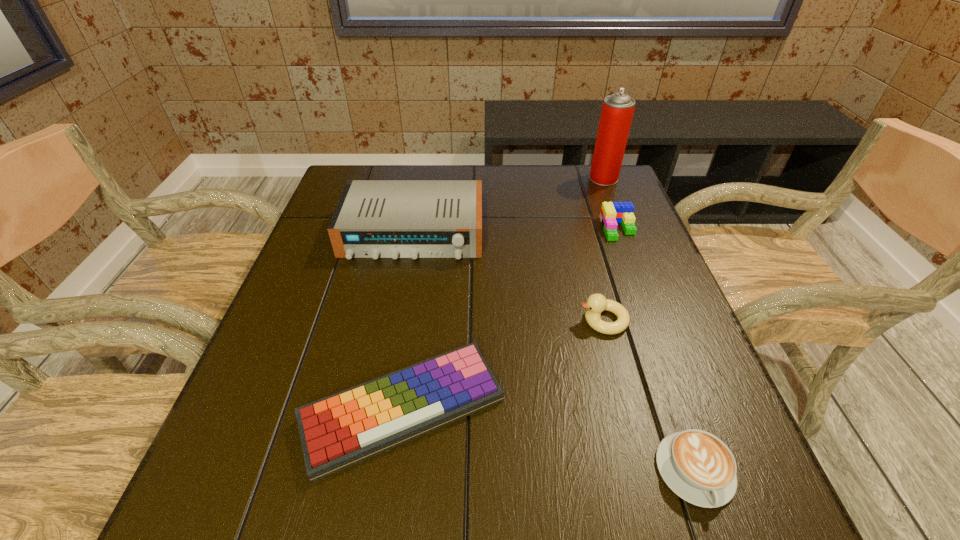
The height and width of the screenshot is (540, 960). I want to click on vacant space located at the beak of the third tallest object, so pyautogui.click(x=478, y=320).

Image resolution: width=960 pixels, height=540 pixels. I want to click on vacant space situated at the beak of the third tallest object, so click(507, 320).

Locate an element on the screen. This screenshot has height=540, width=960. vacant space located 0.250m at the beak of the third tallest object is located at coordinates (460, 320).

You are a GUI agent. You are given a task and a screenshot of the screen. Output one action in this format:
    pyautogui.click(x=<x>, y=<y>)
    Task: Click on the free space located 0.360m on the left of the Lego
    
    Given the screenshot: What is the action you would take?
    pyautogui.click(x=467, y=228)

Locate an element on the screen. Image resolution: width=960 pixels, height=540 pixels. vacant area situated 0.140m on the right of the computer keyboard is located at coordinates (584, 410).

This screenshot has height=540, width=960. In order to click on aerosol can that is at the far edge in this screenshot , I will do `click(617, 111)`.

Where is `radio receiver that is positioned at the far edge`? This screenshot has height=540, width=960. radio receiver that is positioned at the far edge is located at coordinates (375, 219).

Find the location of a particular element. This screenshot has height=540, width=960. cappuccino that is at the near edge is located at coordinates (697, 466).

This screenshot has width=960, height=540. Identify the location of computer keyboard present at the near edge. tap(345, 428).

At what (x,y) coordinates should I click in order to perform the action: click on radio receiver that is at the left edge. Please return your answer as a coordinate pair (x, y). Looking at the image, I should click on (375, 219).